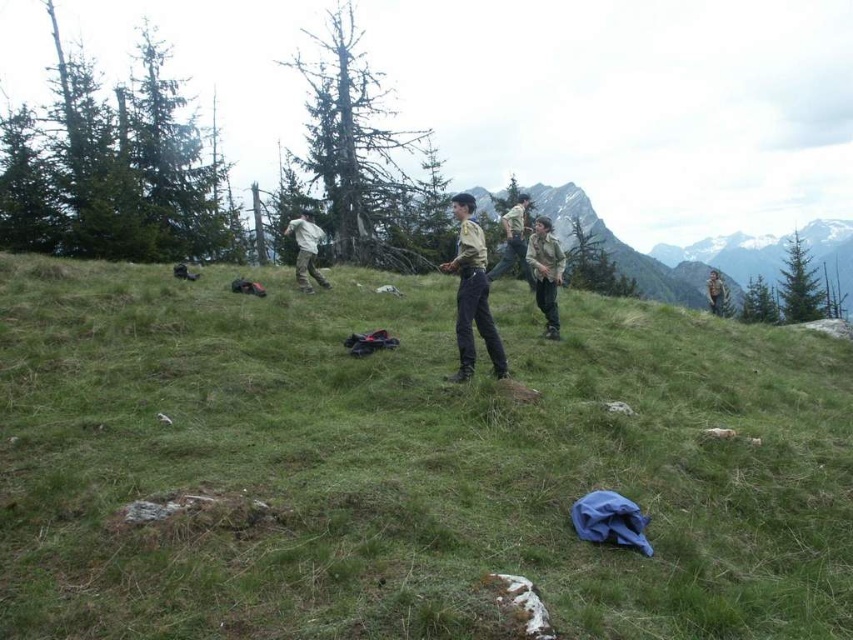
Question: Does green grassy at center appear under brown uniform at upper right?

Choices:
 (A) no
 (B) yes

Answer: (B)

Question: Does green uniform at center appear on the right side of khaki uniform at center?

Choices:
 (A) yes
 (B) no

Answer: (B)

Question: Which of the following is the closest to the observer?

Choices:
 (A) (395, 515)
 (B) (509, 237)

Answer: (A)

Question: Which point is closer to the camera?

Choices:
 (A) green grassy at center
 (B) brown uniform at upper right

Answer: (A)

Question: Estimate the real-world distances between objects in this image. Which object is farther from the white matte pants at center?

Choices:
 (A) brown uniform at upper right
 (B) brown uniform at center

Answer: (A)

Question: Is green uniform at center below white matte pants at center?

Choices:
 (A) yes
 (B) no

Answer: (A)